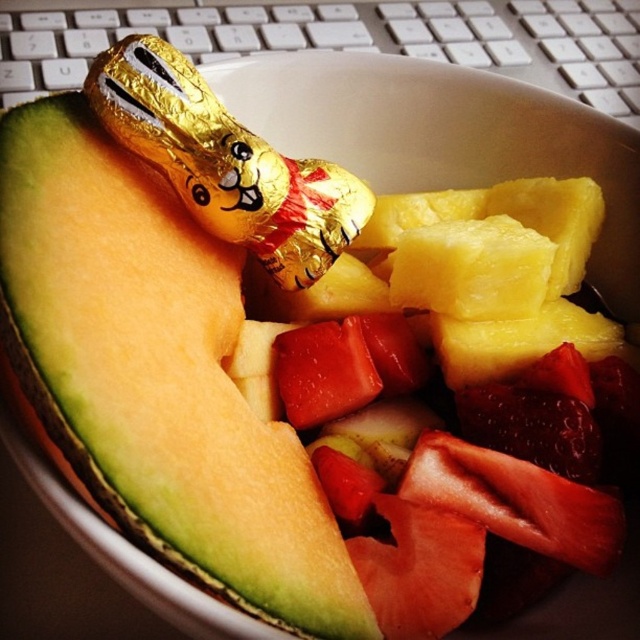
Question: Among these points, which one is nearest to the camera?

Choices:
 (A) (296, 632)
 (B) (228, 180)

Answer: (A)

Question: Where is gold foil chocolate bunny at upper center located in relation to gold foil chocolate at upper center in the image?

Choices:
 (A) left
 (B) right

Answer: (B)

Question: Does green matte cantaloupe at upper left come in front of gold foil chocolate at upper center?

Choices:
 (A) yes
 (B) no

Answer: (A)

Question: Which object is the closest to the gold foil chocolate bunny at upper center?

Choices:
 (A) gold foil chocolate at upper center
 (B) green matte cantaloupe at upper left

Answer: (A)

Question: Can you confirm if green matte cantaloupe at upper left is smaller than gold foil chocolate bunny at upper center?

Choices:
 (A) no
 (B) yes

Answer: (A)

Question: Based on their relative distances, which object is farther from the gold foil chocolate bunny at upper center?

Choices:
 (A) gold foil chocolate at upper center
 (B) green matte cantaloupe at upper left

Answer: (B)